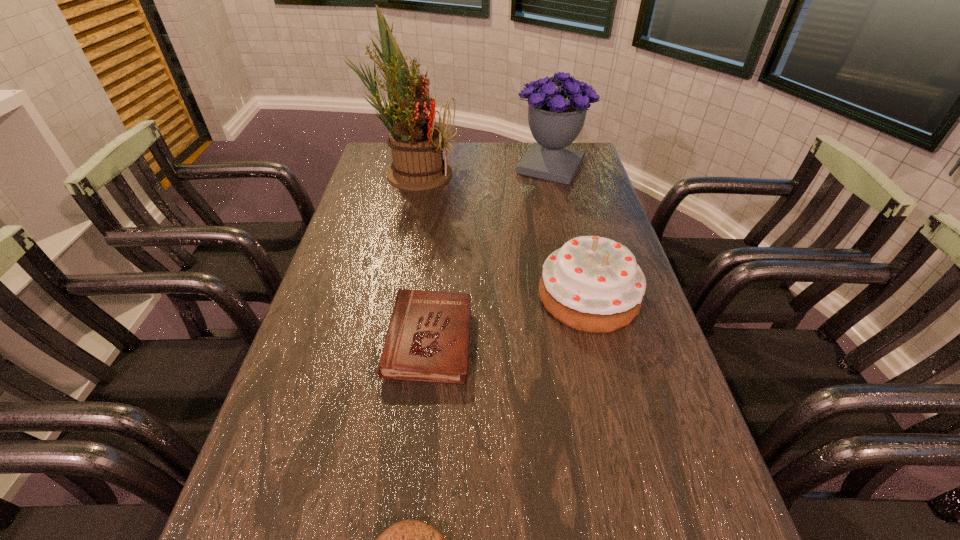
The image size is (960, 540). Find the location of `flower arrangement`. flower arrangement is located at coordinates (417, 145).

Find the location of a particular element. This screenshot has height=540, width=960. the second tallest object is located at coordinates (556, 117).

You are a GUI agent. You are given a task and a screenshot of the screen. Output one action in this format:
    pyautogui.click(x=<x>, y=<y>)
    Task: Click on the cake
    
    Given the screenshot: What is the action you would take?
    pyautogui.click(x=593, y=284)

In order to click on hardback book in this screenshot , I will do tap(427, 340).

Where is `free space located in front of the flower arrangement with the fan visible`? This screenshot has height=540, width=960. free space located in front of the flower arrangement with the fan visible is located at coordinates (554, 172).

This screenshot has width=960, height=540. Find the location of `blank space located 0.100m on the left of the bouquet`. blank space located 0.100m on the left of the bouquet is located at coordinates (487, 167).

Identify the location of vacant region located 0.220m on the left of the third tallest object. [451, 296].

Locate an element on the screen. The width and height of the screenshot is (960, 540). blank space located on the back of the hardback book is located at coordinates (435, 284).

Find the location of a particular element. This screenshot has width=960, height=540. flower arrangement located in the far edge section of the desktop is located at coordinates (417, 145).

Locate an element on the screen. This screenshot has height=540, width=960. bouquet at the far edge is located at coordinates (556, 117).